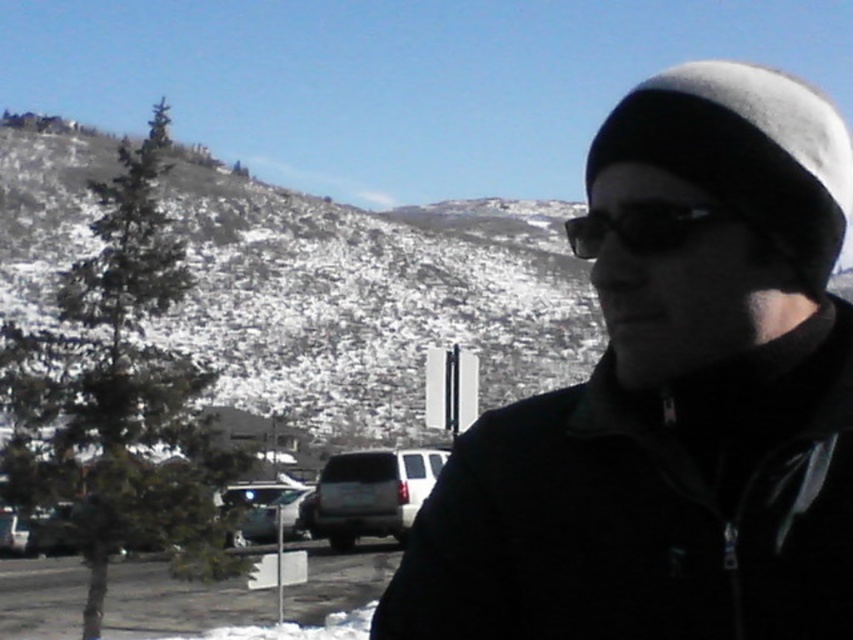
Question: Is black matte jacket at center bigger than metallic silver sedan at lower left?

Choices:
 (A) no
 (B) yes

Answer: (A)

Question: Among these points, which one is nearest to the camera?

Choices:
 (A) (682, 272)
 (B) (415, 273)
 (C) (270, 529)

Answer: (A)

Question: Considering the relative positions of snowy textured hillside at upper left and metallic silver sedan at lower left in the image provided, where is snowy textured hillside at upper left located with respect to metallic silver sedan at lower left?

Choices:
 (A) left
 (B) right

Answer: (A)

Question: Observing the image, what is the correct spatial positioning of snowy textured hillside at upper left in reference to metallic silver sedan at lower left?

Choices:
 (A) right
 (B) left

Answer: (B)

Question: Which object is the farthest from the black matte jacket at center?

Choices:
 (A) silver metallic suv at center
 (B) snowy textured hillside at upper left
 (C) metallic silver sedan at lower left

Answer: (B)

Question: Which object is positioned closest to the black matte jacket at center?

Choices:
 (A) snowy textured hillside at upper left
 (B) silver metallic suv at center

Answer: (B)